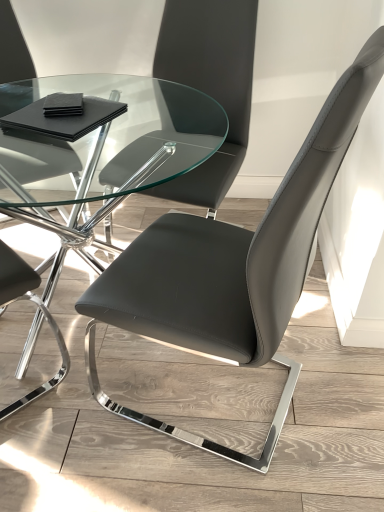
At what (x,y) coordinates should I click in order to perform the action: click on vacant area that is situated to the right of matte black chair at center, placed as the 2th chair when sorted from top to bottom. Please return your answer as a coordinate pair (x, y). This screenshot has height=512, width=384. Looking at the image, I should click on (333, 385).